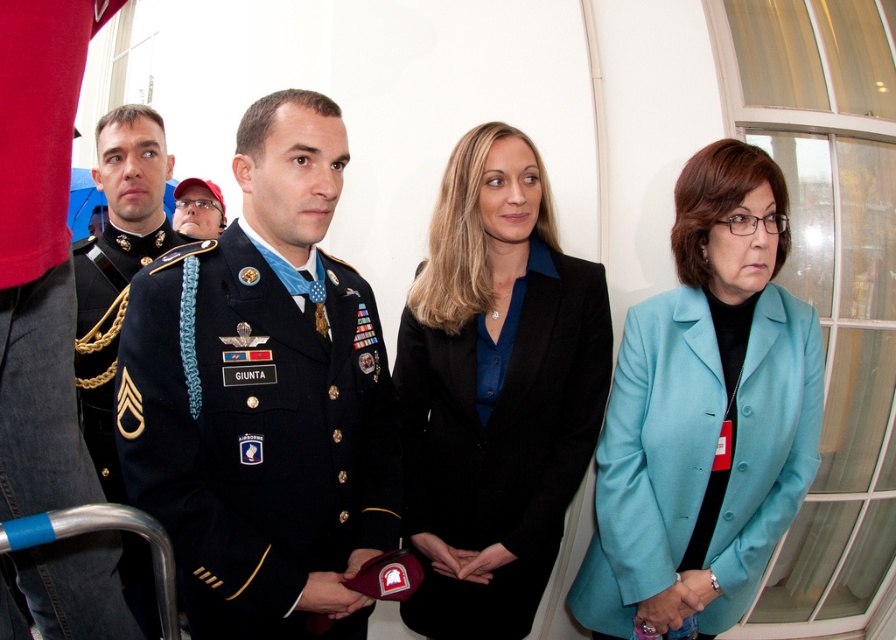
Question: Is teal fabric jacket at right thinner than black smooth blazer at center?

Choices:
 (A) yes
 (B) no

Answer: (A)

Question: Does shiny black uniform at center have a larger size compared to teal fabric jacket at right?

Choices:
 (A) yes
 (B) no

Answer: (B)

Question: Which point is farther from the camera taking this photo?

Choices:
 (A) (668, 416)
 (B) (191, 216)
 (C) (134, 182)

Answer: (B)

Question: Can you confirm if black smooth blazer at center is wider than matte black cap at upper left?

Choices:
 (A) yes
 (B) no

Answer: (A)

Question: Among these objects, which one is farthest from the camera?

Choices:
 (A) shiny black uniform at center
 (B) matte black cap at upper left
 (C) shiny black uniform at left

Answer: (B)

Question: Which of the following is the closest to the observer?

Choices:
 (A) (135, 211)
 (B) (724, 234)
 (C) (166, 461)
 (D) (524, 426)

Answer: (C)